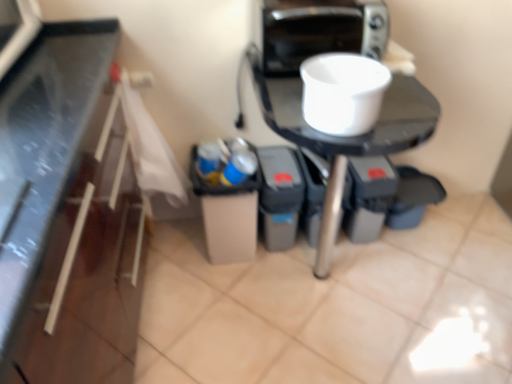
Measure the distance between point (214,153) and camera.

The distance of point (214,153) from camera is 5.04 feet.

Describe the element at coordinates (226, 163) in the screenshot. This screenshot has width=512, height=384. I see `blue plastic cup at center` at that location.

Locate an element on the screen. metallic silver toaster at upper right is located at coordinates (320, 31).

The height and width of the screenshot is (384, 512). In the image, there is a white matte bowl at upper center. In order to click on garbage below it (from a real-world perspective) in this screenshot , I will do `click(226, 163)`.

How different are the orientations of blue plastic cup at center and white matte bowl at upper center in degrees?

They differ by 25.3 degrees in their facing directions.

Which object is wider, blue plastic cup at center or white matte bowl at upper center?

white matte bowl at upper center is wider.

Is white matte bowl at upper center completely or partially inside blue plastic cup at center?

That's incorrect, white matte bowl at upper center is not inside blue plastic cup at center.

From the image's perspective, is blue plastic cup at center located above or below white glossy table at center?

From the image's perspective, blue plastic cup at center appears above white glossy table at center.

Which object is positioned more to the left, blue plastic cup at center or white glossy table at center?

blue plastic cup at center is more to the left.

Is blue plastic cup at center positioned before white glossy table at center?

No, blue plastic cup at center is behind white glossy table at center.

Is blue plastic cup at center not within white glossy table at center?

blue plastic cup at center is positioned outside white glossy table at center.

Looking at this image, considering the sizes of objects metallic silver toaster at upper right and white matte bowl at upper center in the image provided, who is shorter, metallic silver toaster at upper right or white matte bowl at upper center?

white matte bowl at upper center is shorter.

From the image's perspective, is metallic silver toaster at upper right above or below white matte bowl at upper center?

From the image's perspective, metallic silver toaster at upper right appears above white matte bowl at upper center.

Between metallic silver toaster at upper right and white matte bowl at upper center, which one has smaller size?

With smaller size is white matte bowl at upper center.

Which object is positioned more to the right, metallic silver toaster at upper right or white matte bowl at upper center?

From the viewer's perspective, white matte bowl at upper center appears more on the right side.

Is white glossy table at center inside the boundaries of metallic silver toaster at upper right, or outside?

white glossy table at center is not enclosed by metallic silver toaster at upper right.

Between point (431, 112) and point (312, 4), which one is positioned behind?

The point (312, 4) is farther.

Does white glossy table at center appear on the left side of metallic silver toaster at upper right?

In fact, white glossy table at center is to the right of metallic silver toaster at upper right.

From the picture: Is white matte bowl at upper center completely or partially outside of white glossy table at center?

white matte bowl at upper center is positioned outside white glossy table at center.

Can you confirm if white matte bowl at upper center is wider than white glossy table at center?

No.

Considering the positions of objects white matte bowl at upper center and white glossy table at center in the image provided, who is more to the right, white matte bowl at upper center or white glossy table at center?

white glossy table at center is more to the right.

Is white matte bowl at upper center taller or shorter than white glossy table at center?

Considering their sizes, white matte bowl at upper center has less height than white glossy table at center.

Which object is wider, white glossy table at center or white matte bowl at upper center?

With larger width is white glossy table at center.

Considering the points (332, 225) and (359, 124), which point is behind, point (332, 225) or point (359, 124)?

Point (332, 225)

Does white glossy table at center have a smaller size compared to white matte bowl at upper center?

Incorrect, white glossy table at center is not smaller in size than white matte bowl at upper center.

From a real-world perspective, is white glossy table at center on top of white matte bowl at upper center?

No, from a real-world perspective, white glossy table at center is not on top of white matte bowl at upper center.

Can you confirm if white glossy table at center is positioned to the left of blue plastic cup at center?

In fact, white glossy table at center is to the right of blue plastic cup at center.

Which is closer to the camera, (378, 145) or (225, 170)?

Point (378, 145) appears to be closer to the viewer than point (225, 170).

Is white glossy table at center positioned in front of blue plastic cup at center?

Yes, the depth of white glossy table at center is less than that of blue plastic cup at center.

This screenshot has width=512, height=384. Identify the location of garbage that is below the white matte bowl at upper center (from the image's perspective). (226, 163).

Where is `table that appears below the blue plastic cup at center (from a real-world perspective)`? The height and width of the screenshot is (384, 512). table that appears below the blue plastic cup at center (from a real-world perspective) is located at coordinates (346, 137).

Which object lies further to the anchor point metallic silver toaster at upper right, white glossy table at center or white matte bowl at upper center?

white matte bowl at upper center is further to metallic silver toaster at upper right.

From the image, which object appears to be nearer to white matte bowl at upper center, blue plastic cup at center or white glossy table at center?

Among the two, white glossy table at center is located nearer to white matte bowl at upper center.

Based on their spatial positions, is metallic silver toaster at upper right or white matte bowl at upper center further from white glossy table at center?

Based on the image, metallic silver toaster at upper right appears to be further to white glossy table at center.

When comparing their distances from metallic silver toaster at upper right, does white matte bowl at upper center or blue plastic cup at center seem closer?

white matte bowl at upper center is closer to metallic silver toaster at upper right.

From the image, which object appears to be farther from white matte bowl at upper center, white glossy table at center or blue plastic cup at center?

The object further to white matte bowl at upper center is blue plastic cup at center.

Based on their spatial positions, is white matte bowl at upper center or metallic silver toaster at upper right further from white glossy table at center?

The object further to white glossy table at center is metallic silver toaster at upper right.

Estimate the real-world distances between objects in this image. Which object is closer to white matte bowl at upper center, blue plastic cup at center or metallic silver toaster at upper right?

metallic silver toaster at upper right lies closer to white matte bowl at upper center than the other object.

Based on their spatial positions, is white matte bowl at upper center or white glossy table at center further from metallic silver toaster at upper right?

white matte bowl at upper center is further to metallic silver toaster at upper right.

You are a GUI agent. You are given a task and a screenshot of the screen. Output one action in this format:
    pyautogui.click(x=<x>, y=<y>)
    Task: Click on the garbage between metallic silver toaster at upper right and white glossy table at center in the up-down direction
    This screenshot has height=384, width=512.
    Given the screenshot: What is the action you would take?
    pyautogui.click(x=226, y=163)

What are the coordinates of `kitchen appliance between metallic silver toaster at upper right and white glossy table at center vertically` in the screenshot? It's located at (343, 92).

In order to click on table positioned between white matte bowl at upper center and blue plastic cup at center from near to far in this screenshot , I will do `click(346, 137)`.

Locate an element on the screen. This screenshot has height=384, width=512. home appliance positioned between white matte bowl at upper center and blue plastic cup at center from near to far is located at coordinates (320, 31).